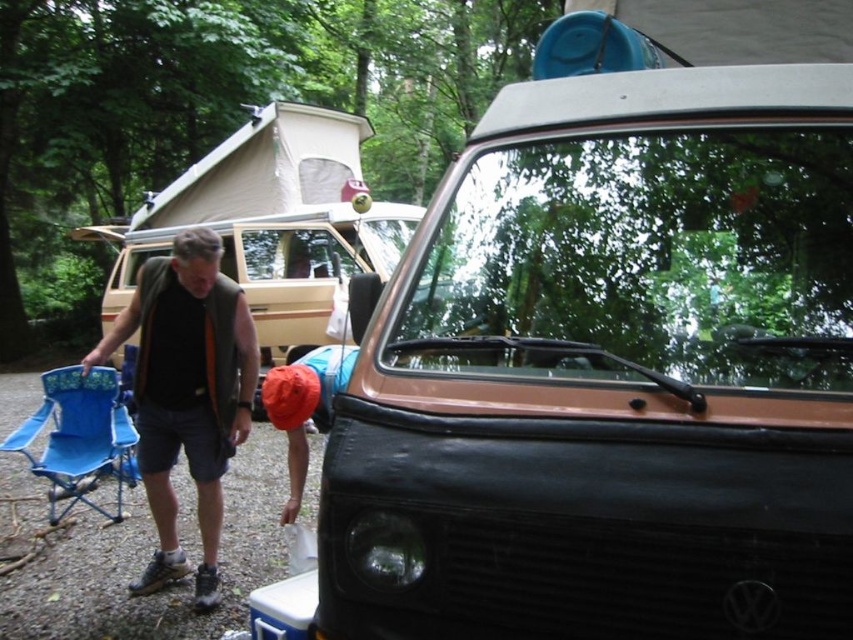
You are trying to decide whether to place a new camping gear box next to the black fabric vest at left and the matte black van at left. Given their sizes, which object can fit more items inside?

The matte black van at left is thicker than the black fabric vest at left, so it can fit more items inside.

You are a hiker who wants to set up a tent near the black matte van at center and the blue fabric folding chair at lower left. Which object should you place the tent closer to if you want it to be sheltered from the rain by the taller object?

The black matte van at center is much taller than the blue fabric folding chair at lower left, so you should place the tent closer to the black matte van at center to be sheltered from the rain.

You are a hiker who wants to retrieve an item from the matte black van at left without disturbing the person in the black fabric vest at left. What is the minimum distance you should maintain between yourself and the van to avoid getting too close to the person?

To avoid getting too close to the person in the black fabric vest at left, you should maintain a distance of at least 3.69 meters from the matte black van at left, as that is the distance between the van and the person.